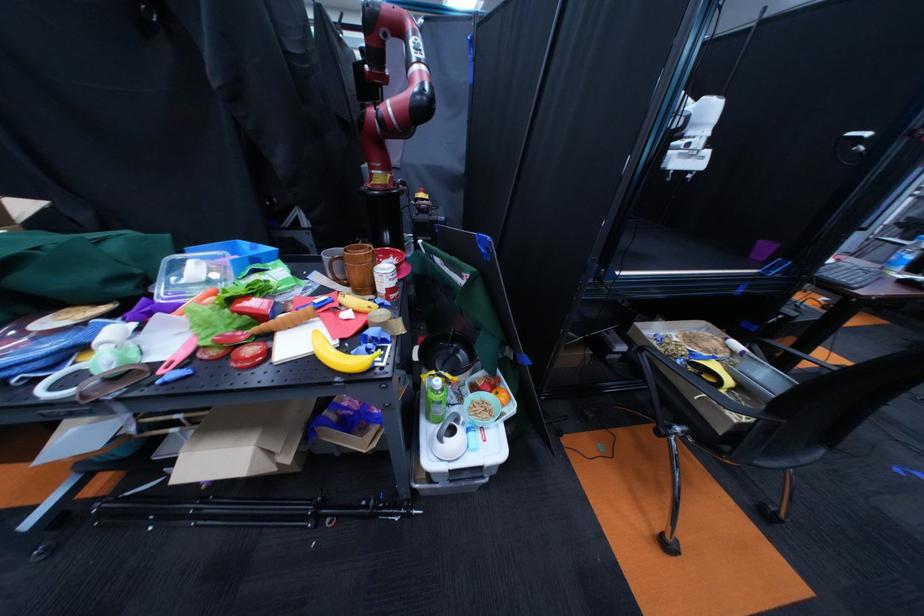
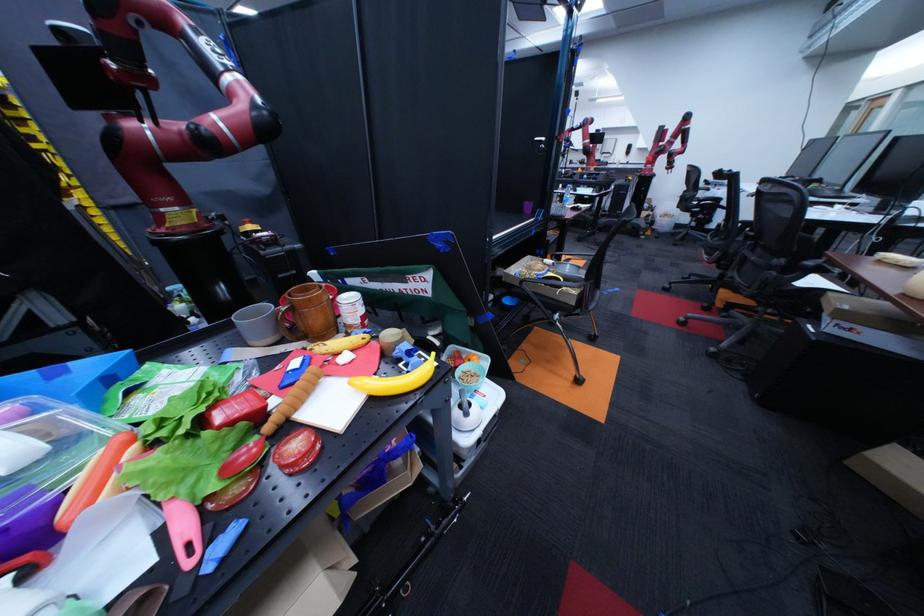
Question: The camera is either moving clockwise (left) or counter-clockwise (right) around the object. The first image is from the beginning of the video and the second image is from the end. Is the camera moving left or right when shooting the video?

Choices:
 (A) Left
 (B) Right

Answer: (A)